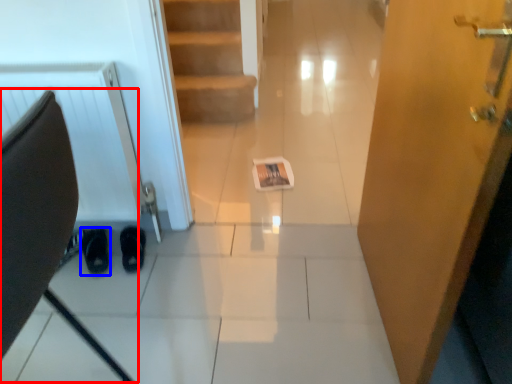
Question: Which object appears closest to the camera in this image, swivel chair (highlighted by a red box) or footwear (highlighted by a blue box)?

Choices:
 (A) swivel chair
 (B) footwear

Answer: (A)